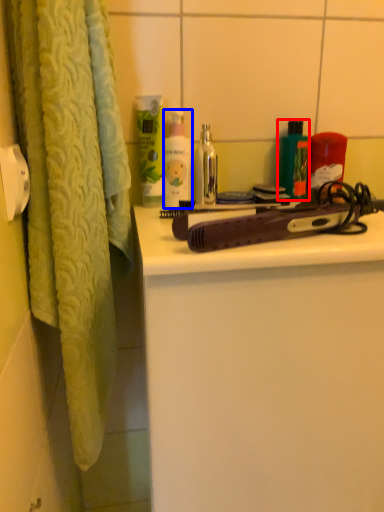
Question: Among these objects, which one is farthest to the camera, product (highlighted by a red box) or cleaning product (highlighted by a blue box)?

Choices:
 (A) product
 (B) cleaning product

Answer: (A)